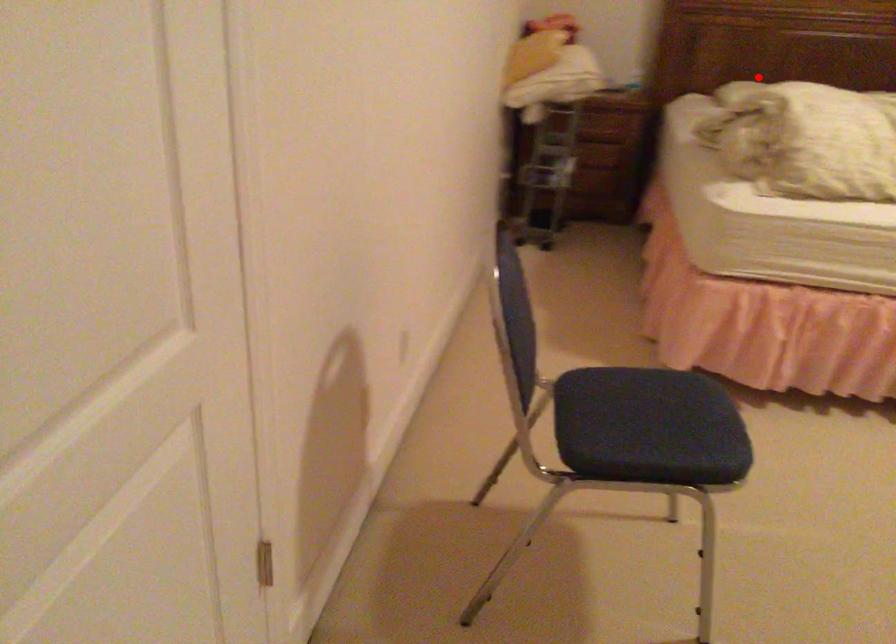
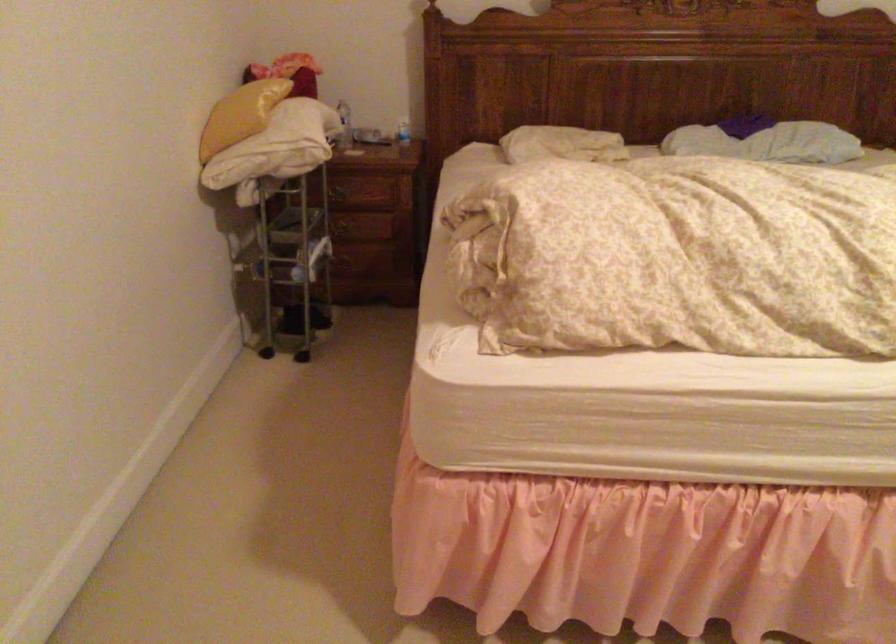
Question: I am providing you with two images of the same scene from different viewpoints. In image1, a red point is highlighted. Considering the same 3D point in image2, which of the following is correct?

Choices:
 (A) It is closer
 (B) It is farther

Answer: (A)